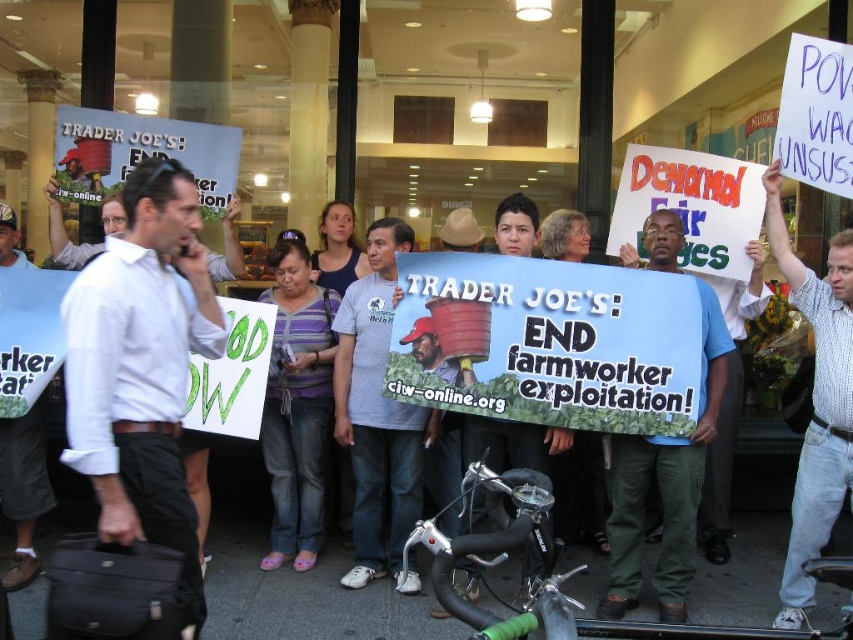
Does point (833, 360) come farther from viewer compared to point (267, 296)?

No, it is in front of (267, 296).

Which is below, white checkered shirt at upper right or purple striped shirt at center?

purple striped shirt at center is lower down.

Is point (796, 612) more distant than point (283, 436)?

No, (796, 612) is in front of (283, 436).

The image size is (853, 640). What are the coordinates of `white checkered shirt at upper right` in the screenshot? It's located at (816, 403).